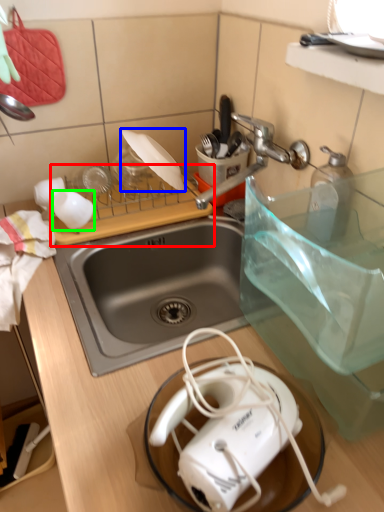
Question: Which object is positioned closest to cutting board (highlighted by a red box)? Select from appliance (highlighted by a blue box) and coffee cup (highlighted by a green box).

Choices:
 (A) appliance
 (B) coffee cup

Answer: (B)